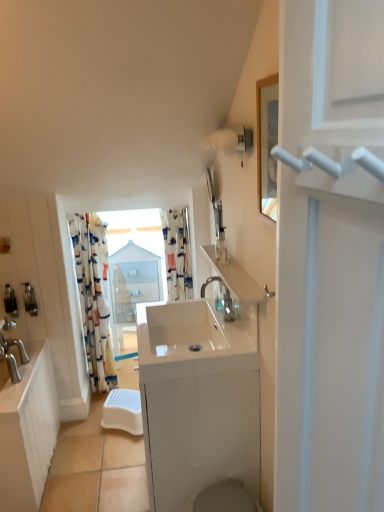
Question: Is metallic silver soap dispenser at left, the 2th toiletry positioned from the back, further to camera compared to printed fabric curtain at center, which appears as the second curtain when viewed from the left?

Choices:
 (A) yes
 (B) no

Answer: (B)

Question: Can you confirm if metallic silver soap dispenser at left, the 2th toiletry positioned from the back, is thinner than printed fabric curtain at center, the first curtain when ordered from right to left?

Choices:
 (A) yes
 (B) no

Answer: (A)

Question: Is the depth of metallic silver soap dispenser at left, the second toiletry when ordered from front to back, less than that of printed fabric curtain at center, the first curtain when ordered from right to left?

Choices:
 (A) no
 (B) yes

Answer: (B)

Question: Is metallic silver soap dispenser at left, the 1th toiletry positioned from the bottom, completely or partially outside of printed fabric curtain at center, which appears as the second curtain when viewed from the left?

Choices:
 (A) no
 (B) yes

Answer: (B)

Question: From a real-world perspective, is metallic silver soap dispenser at left, the 1th toiletry in the left-to-right sequence, located beneath printed fabric curtain at center, which appears as the second curtain when viewed from the left?

Choices:
 (A) no
 (B) yes

Answer: (B)

Question: Is white glossy toilet bowl at lower center bigger or smaller than clear plastic bottle at upper center, which appears as the 3th toiletry when ordered from the bottom?

Choices:
 (A) big
 (B) small

Answer: (A)

Question: In terms of width, does white glossy toilet bowl at lower center look wider or thinner when compared to clear plastic bottle at upper center, acting as the third toiletry starting from the back?

Choices:
 (A) thin
 (B) wide

Answer: (B)

Question: Would you say white glossy toilet bowl at lower center is to the left or to the right of clear plastic bottle at upper center, the first toiletry viewed from the right, in the picture?

Choices:
 (A) right
 (B) left

Answer: (B)

Question: Is point (195, 499) positioned closer to the camera than point (220, 249)?

Choices:
 (A) closer
 (B) farther

Answer: (A)

Question: From the image's perspective, relative to translucent plastic soap dispenser at left, arranged as the 2th toiletry when viewed from the right, is white glossy sink at center above or below?

Choices:
 (A) above
 (B) below

Answer: (B)

Question: Considering the positions of white glossy sink at center and translucent plastic soap dispenser at left, acting as the second toiletry starting from the bottom, in the image, is white glossy sink at center wider or thinner than translucent plastic soap dispenser at left, acting as the second toiletry starting from the bottom,?

Choices:
 (A) wide
 (B) thin

Answer: (A)

Question: Is white glossy sink at center in front of or behind translucent plastic soap dispenser at left, which appears as the 3th toiletry when viewed from the front, in the image?

Choices:
 (A) behind
 (B) front

Answer: (B)

Question: In terms of size, does white glossy sink at center appear bigger or smaller than translucent plastic soap dispenser at left, acting as the second toiletry starting from the bottom?

Choices:
 (A) big
 (B) small

Answer: (A)

Question: From the image's perspective, is white glossy sink at left, which is counted as the 1th counter top, starting from the left, located above or below satin nickel faucet at center?

Choices:
 (A) above
 (B) below

Answer: (B)

Question: In the image, is white glossy sink at left, which is counted as the 1th counter top, starting from the left, positioned in front of or behind satin nickel faucet at center?

Choices:
 (A) front
 (B) behind

Answer: (B)